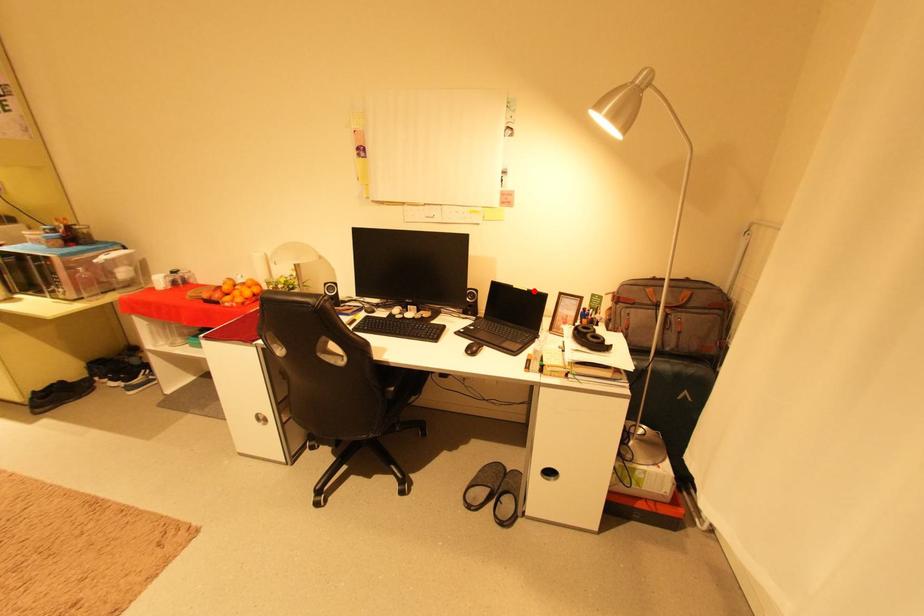
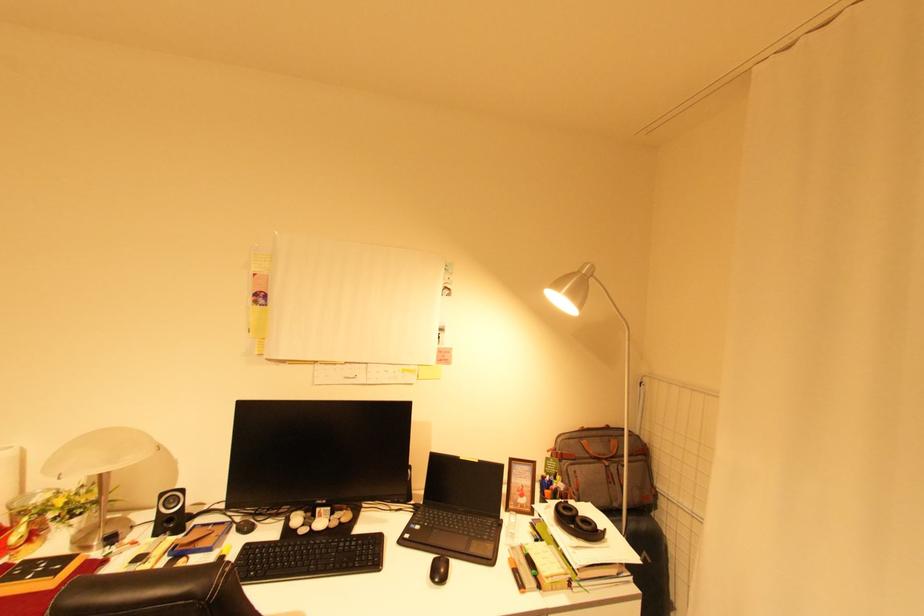
Where in the second image is the point corresponding to the highlighted location from the first image?

(484, 462)